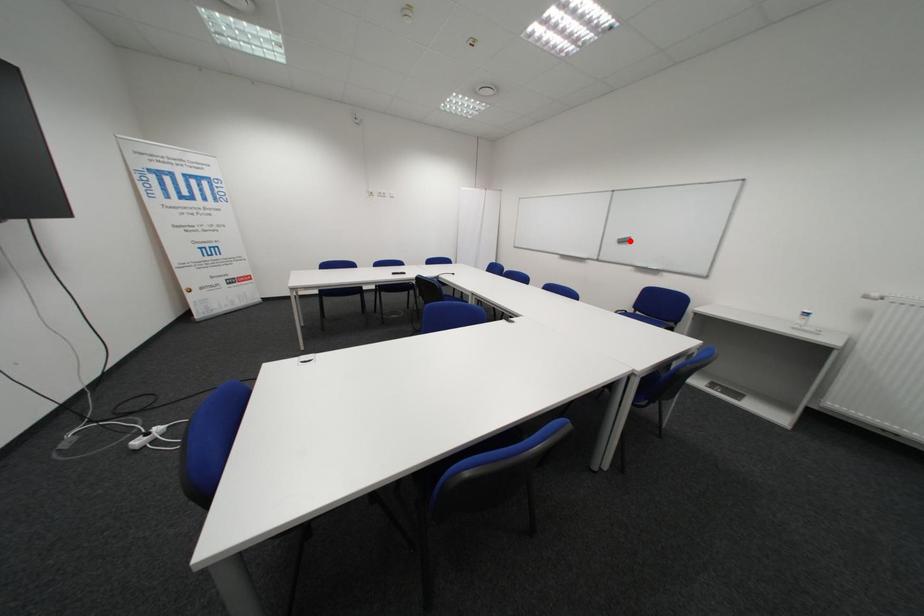
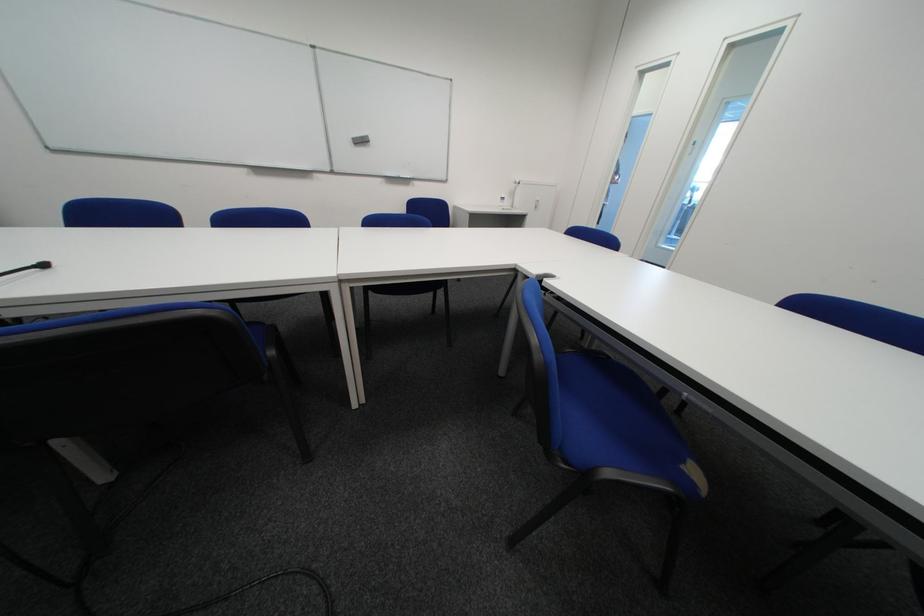
The point at the highlighted location is marked in the first image. Where is the corresponding point in the second image?

(365, 140)